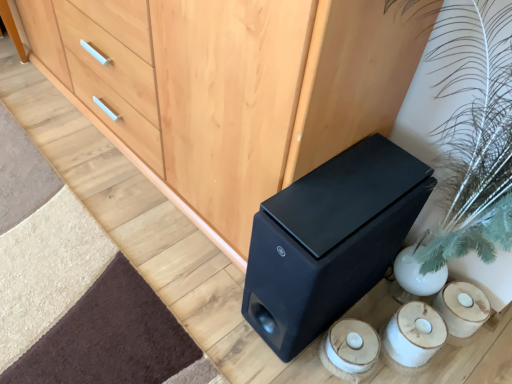
Question: Is matte black speaker at lower right with white ceramic candle holder at lower right?

Choices:
 (A) no
 (B) yes

Answer: (A)

Question: From the image's perspective, is matte black speaker at lower right under white ceramic candle holder at lower right?

Choices:
 (A) no
 (B) yes

Answer: (A)

Question: Is white ceramic candle holder at lower right a part of matte black speaker at lower right?

Choices:
 (A) yes
 (B) no

Answer: (B)

Question: Can you confirm if matte black speaker at lower right is positioned to the right of white ceramic candle holder at lower right?

Choices:
 (A) no
 (B) yes

Answer: (A)

Question: Considering the relative sizes of matte black speaker at lower right and white ceramic candle holder at lower right in the image provided, is matte black speaker at lower right smaller than white ceramic candle holder at lower right?

Choices:
 (A) yes
 (B) no

Answer: (B)

Question: Looking at the image, does matte wood chest of drawers at center seem bigger or smaller compared to white ceramic candle holder at lower right?

Choices:
 (A) small
 (B) big

Answer: (B)

Question: From the image's perspective, is matte wood chest of drawers at center located above or below white ceramic candle holder at lower right?

Choices:
 (A) below
 (B) above

Answer: (B)

Question: Is point (x=275, y=77) positioned closer to the camera than point (x=331, y=344)?

Choices:
 (A) closer
 (B) farther

Answer: (A)

Question: In terms of width, does matte wood chest of drawers at center look wider or thinner when compared to white ceramic candle holder at lower right?

Choices:
 (A) thin
 (B) wide

Answer: (B)

Question: Looking at the image, does matte wood chest of drawers at center seem bigger or smaller compared to matte black speaker at lower right?

Choices:
 (A) small
 (B) big

Answer: (B)

Question: Does point (241, 0) appear closer or farther from the camera than point (305, 231)?

Choices:
 (A) closer
 (B) farther

Answer: (A)

Question: From their relative heights in the image, would you say matte wood chest of drawers at center is taller or shorter than matte black speaker at lower right?

Choices:
 (A) short
 (B) tall

Answer: (B)

Question: Would you say matte wood chest of drawers at center is inside or outside matte black speaker at lower right?

Choices:
 (A) outside
 (B) inside

Answer: (A)

Question: Looking at their shapes, would you say white ceramic candle holder at lower right is wider or thinner than matte black speaker at lower right?

Choices:
 (A) thin
 (B) wide

Answer: (A)

Question: Does point (347, 344) appear closer or farther from the camera than point (292, 342)?

Choices:
 (A) closer
 (B) farther

Answer: (B)